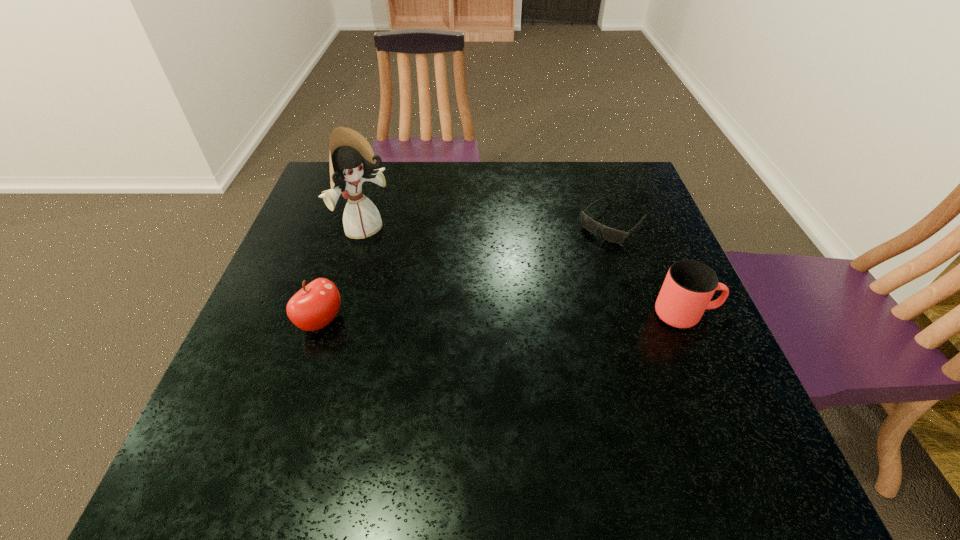
This screenshot has width=960, height=540. I want to click on free area in between the apple and the tallest object, so click(343, 275).

Locate an element on the screen. free area in between the sunglasses and the cup is located at coordinates (649, 269).

Where is `vacant area between the doll and the apple`? The height and width of the screenshot is (540, 960). vacant area between the doll and the apple is located at coordinates (343, 275).

Locate which object ranks third in proximity to the apple. Please provide its 2D coordinates. Your answer should be formatted as a tuple, i.e. [(x, y)], where the tuple contains the x and y coordinates of a point satisfying the conditions above.

[(689, 285)]

Find the location of `the closest object relative to the apple`. the closest object relative to the apple is located at coordinates (352, 162).

The image size is (960, 540). I want to click on vacant space that satisfies the following two spatial constraints: 1. on the back side of the apple; 2. on the handle side of the cup, so click(324, 314).

The height and width of the screenshot is (540, 960). Identify the location of free point that satisfies the following two spatial constraints: 1. on the back side of the apple; 2. on the right side of the tallest object. (350, 230).

Identify the location of free spot that satisfies the following two spatial constraints: 1. on the back side of the doll; 2. on the left side of the shortest object. (367, 224).

This screenshot has width=960, height=540. I want to click on free point that satisfies the following two spatial constraints: 1. on the back side of the tallest object; 2. on the left side of the apple, so click(350, 230).

Image resolution: width=960 pixels, height=540 pixels. What are the coordinates of `free space that satisfies the following two spatial constraints: 1. on the back side of the doll; 2. on the left side of the apple` in the screenshot? It's located at (350, 230).